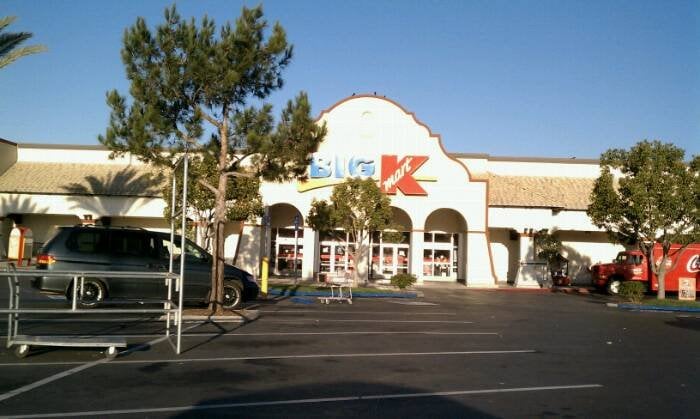
Find the location of a particular element. The height and width of the screenshot is (419, 700). white writing area is located at coordinates (690, 266), (634, 271), (398, 174).